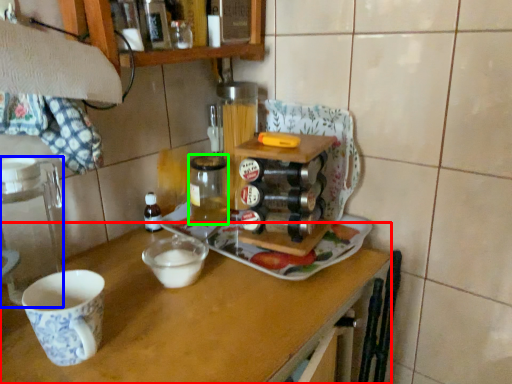
Question: Estimate the real-world distances between objects in this image. Which object is farther from table (highlighted by a red box), appliance (highlighted by a blue box) or beverage (highlighted by a green box)?

Choices:
 (A) appliance
 (B) beverage

Answer: (B)